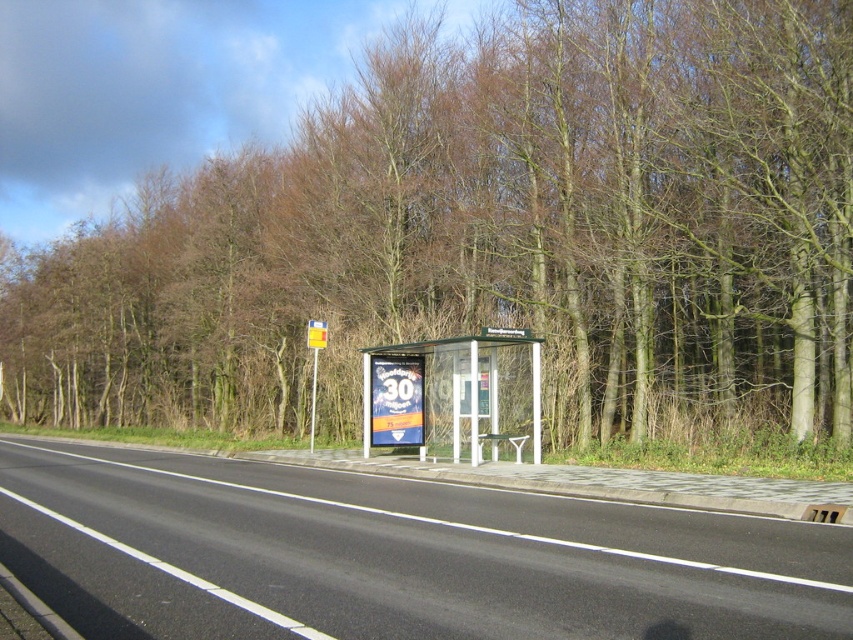
Question: Which of the following is the closest to the observer?

Choices:
 (A) (315, 364)
 (B) (424, 353)
 (C) (256, 570)

Answer: (C)

Question: Which object is the farthest from the transparent plastic bus stop at center?

Choices:
 (A) yellow plastic sign at center
 (B) brown leafless trees at center
 (C) black asphalt highway at center

Answer: (B)

Question: Among these points, which one is farthest from the camera?

Choices:
 (A) (30, 536)
 (B) (665, 26)

Answer: (B)

Question: Can you confirm if brown leafless trees at center is bigger than transparent plastic bus stop at center?

Choices:
 (A) yes
 (B) no

Answer: (A)

Question: Can you confirm if brown leafless trees at center is positioned to the right of transparent plastic bus stop at center?

Choices:
 (A) yes
 (B) no

Answer: (B)

Question: Does brown leafless trees at center come behind black asphalt highway at center?

Choices:
 (A) yes
 (B) no

Answer: (A)